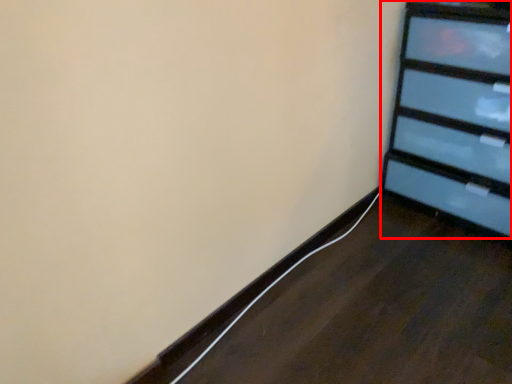
Question: From the image's perspective, where is furniture (annotated by the red box) located relative to cable?

Choices:
 (A) below
 (B) above

Answer: (B)